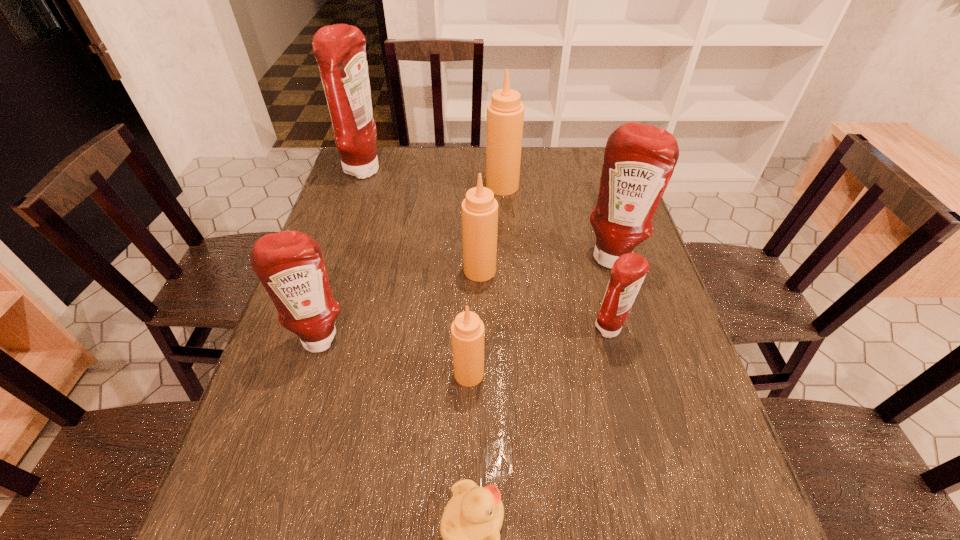
Find the location of `free space located 0.230m on the front of the farthest tan condiment`. free space located 0.230m on the front of the farthest tan condiment is located at coordinates (506, 244).

What are the coordinates of `vacant space located 0.300m on the back of the second biggest red condiment` in the screenshot? It's located at (588, 180).

Locate an element on the screen. The height and width of the screenshot is (540, 960). vacant area situated 0.210m on the right of the second nearest tan condiment is located at coordinates (575, 270).

At what (x,y) coordinates should I click in order to perform the action: click on vacant space located on the back of the second smallest red condiment. Please return your answer as a coordinate pair (x, y). This screenshot has width=960, height=540. Looking at the image, I should click on (342, 270).

At what (x,y) coordinates should I click in order to perform the action: click on vacant region located on the back of the smallest red condiment. Please return your answer as a coordinate pair (x, y). Image resolution: width=960 pixels, height=540 pixels. Looking at the image, I should click on (598, 286).

Find the location of a particular element. vacant space situated 0.190m on the left of the nearest condiment is located at coordinates tap(367, 374).

Where is `object situated at the far left corner`? object situated at the far left corner is located at coordinates (340, 49).

This screenshot has height=540, width=960. I want to click on vacant space at the far edge, so click(476, 175).

Image resolution: width=960 pixels, height=540 pixels. In order to click on vacant region at the near edge of the desktop in this screenshot , I will do `click(555, 539)`.

This screenshot has width=960, height=540. Identify the location of free point at the left edge. (352, 237).